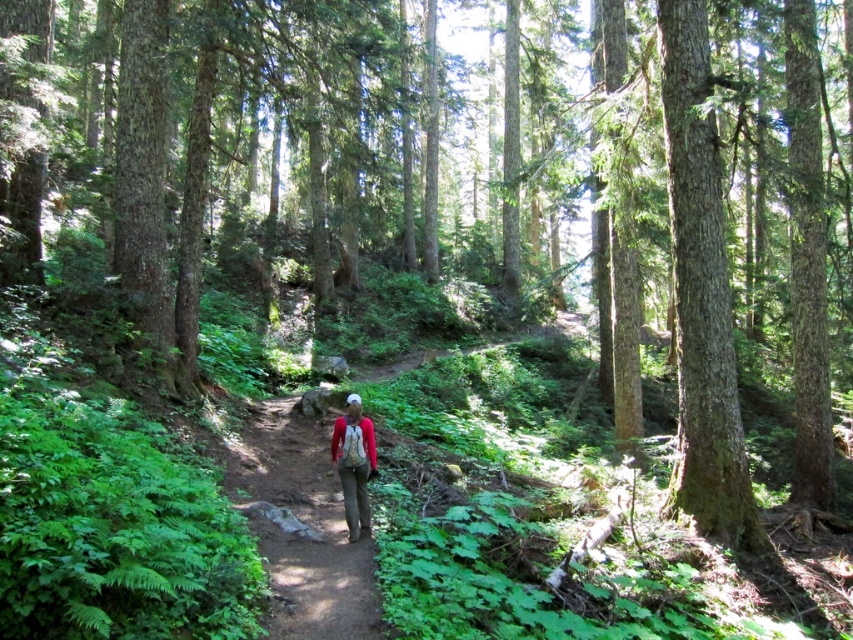
Question: Is smooth brown tree trunk at right positioned at the back of matte red shirt at center?

Choices:
 (A) no
 (B) yes

Answer: (B)

Question: Can you confirm if smooth brown tree trunk at right is positioned above matte red shirt at center?

Choices:
 (A) yes
 (B) no

Answer: (A)

Question: Estimate the real-world distances between objects in this image. Which object is farther from the matte red shirt at center?

Choices:
 (A) smooth brown tree trunk at right
 (B) brown dirt trail at center

Answer: (A)

Question: Can you confirm if smooth brown tree trunk at right is positioned to the left of matte red shirt at center?

Choices:
 (A) yes
 (B) no

Answer: (B)

Question: Which of these objects is positioned farthest from the matte red shirt at center?

Choices:
 (A) smooth brown tree trunk at right
 (B) brown dirt trail at center

Answer: (A)

Question: Among these objects, which one is nearest to the camera?

Choices:
 (A) matte red shirt at center
 (B) brown dirt trail at center

Answer: (B)